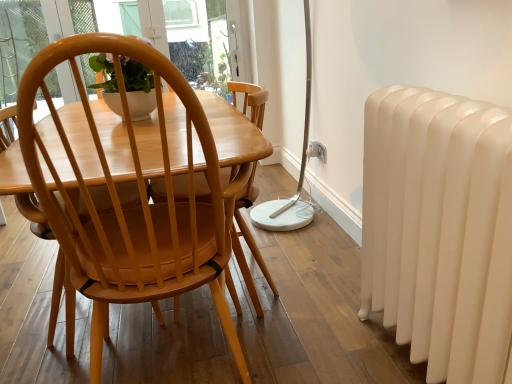
Question: In terms of height, does white plastic electric outlet at center look taller or shorter compared to matte wood chair at center?

Choices:
 (A) tall
 (B) short

Answer: (B)

Question: Looking at the image, does white plastic electric outlet at center seem bigger or smaller compared to matte wood chair at center?

Choices:
 (A) big
 (B) small

Answer: (B)

Question: Which object is positioned closest to the white glossy radiator at right?

Choices:
 (A) white plastic electric outlet at center
 (B) matte wood chair at center
 (C) white plastic power outlet at lower center

Answer: (B)

Question: Estimate the real-world distances between objects in this image. Which object is closer to the white plastic electric outlet at center?

Choices:
 (A) white plastic power outlet at lower center
 (B) white glossy radiator at right
 (C) matte wood chair at center

Answer: (A)